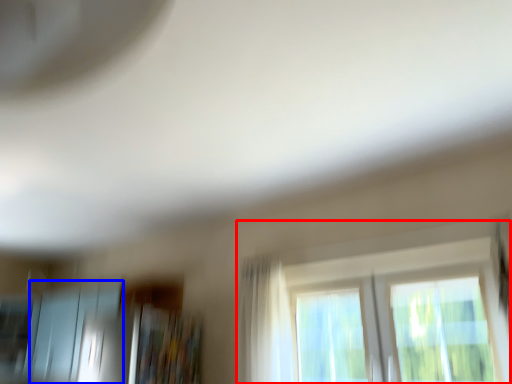
Question: Which point is closer to the camera, window (highlighted by a red box) or screen door (highlighted by a blue box)?

Choices:
 (A) window
 (B) screen door

Answer: (A)